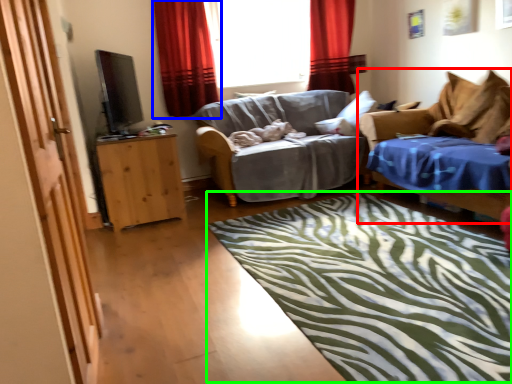
Question: Which is nearer to the studio couch (highlighted by a red box)? curtain (highlighted by a blue box) or mat (highlighted by a green box).

Choices:
 (A) curtain
 (B) mat

Answer: (B)